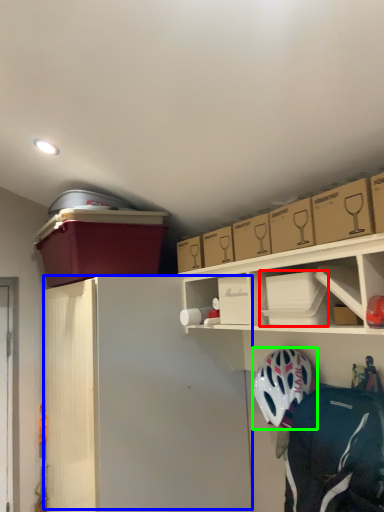
Question: Which object is positioned farthest from box (highlighted by a red box)? Select from wide (highlighted by a blue box) and helmet (highlighted by a green box).

Choices:
 (A) wide
 (B) helmet

Answer: (A)